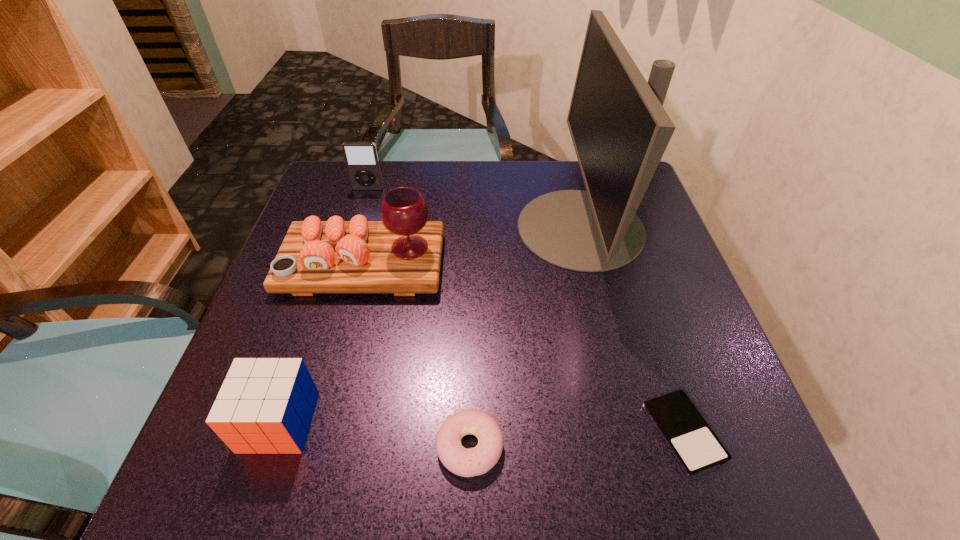
Identify the location of doughnut present at the near edge. The width and height of the screenshot is (960, 540). (464, 462).

Image resolution: width=960 pixels, height=540 pixels. What are the coordinates of `iPod that is at the near edge` in the screenshot? It's located at (696, 447).

Where is `platter that is positioned at the left edge`? platter that is positioned at the left edge is located at coordinates (401, 254).

This screenshot has height=540, width=960. Identify the location of iPod located at the left edge. (361, 158).

Locate an element on the screen. This screenshot has width=960, height=540. cube positioned at the left edge is located at coordinates (265, 405).

Locate an element on the screen. computer monitor that is at the right edge is located at coordinates (620, 130).

Where is `iPod located at the right edge`? iPod located at the right edge is located at coordinates (696, 447).

At what (x,y) coordinates should I click in order to perform the action: click on object at the far left corner. Please return your answer as a coordinate pair (x, y). The height and width of the screenshot is (540, 960). Looking at the image, I should click on (361, 158).

Where is `object situated at the near left corner`? This screenshot has width=960, height=540. object situated at the near left corner is located at coordinates (265, 405).

Image resolution: width=960 pixels, height=540 pixels. I want to click on object at the far right corner, so click(x=620, y=130).